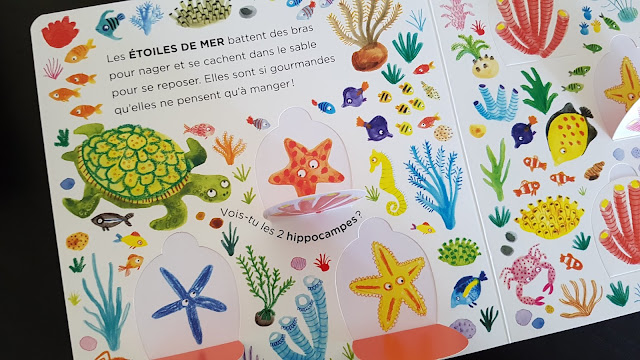
Image resolution: width=640 pixels, height=360 pixels. What are the coordinates of `left page of book` in the screenshot? It's located at (226, 106).